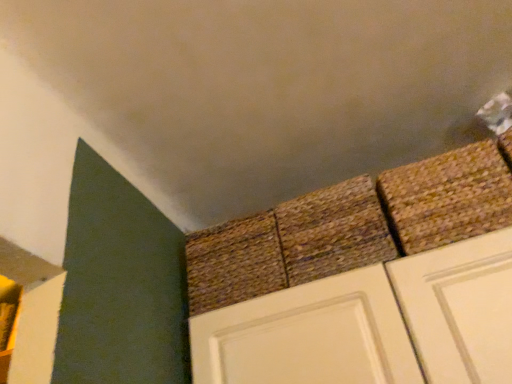
Question: From the image's perspective, is rustic woven mat at center, placed as the second brick when sorted from right to left, above brown woven rug at upper right, placed as the third brick when sorted from left to right?

Choices:
 (A) yes
 (B) no

Answer: (B)

Question: Would you say brown woven rug at upper right, the first brick positioned from the right, is part of rustic woven mat at center, placed as the second brick when sorted from right to left,'s contents?

Choices:
 (A) no
 (B) yes

Answer: (A)

Question: Is rustic woven mat at center, placed as the second brick when sorted from right to left, outside of brown woven rug at upper right, placed as the third brick when sorted from left to right?

Choices:
 (A) yes
 (B) no

Answer: (A)

Question: Is rustic woven mat at center, placed as the second brick when sorted from right to left, positioned behind brown woven rug at upper right, the first brick positioned from the right?

Choices:
 (A) yes
 (B) no

Answer: (A)

Question: Would you say brown woven mat at center, which ranks as the 1th brick in left-to-right order, is inside or outside rustic woven mat at center, the 2th brick in the left-to-right sequence?

Choices:
 (A) outside
 (B) inside

Answer: (A)

Question: Looking at their shapes, would you say brown woven mat at center, marked as the third brick in a right-to-left arrangement, is wider or thinner than rustic woven mat at center, placed as the second brick when sorted from right to left?

Choices:
 (A) thin
 (B) wide

Answer: (A)

Question: Relative to rustic woven mat at center, placed as the second brick when sorted from right to left, is brown woven mat at center, marked as the third brick in a right-to-left arrangement, in front or behind?

Choices:
 (A) behind
 (B) front

Answer: (A)

Question: From a real-world perspective, relative to rustic woven mat at center, placed as the second brick when sorted from right to left, is brown woven mat at center, which ranks as the 1th brick in left-to-right order, vertically above or below?

Choices:
 (A) below
 (B) above

Answer: (A)

Question: Visually, is rustic woven mat at center, placed as the second brick when sorted from right to left, positioned to the left or to the right of brown woven rug at upper right, placed as the third brick when sorted from left to right?

Choices:
 (A) right
 (B) left

Answer: (B)

Question: From the image's perspective, relative to brown woven rug at upper right, the first brick positioned from the right, is rustic woven mat at center, placed as the second brick when sorted from right to left, above or below?

Choices:
 (A) below
 (B) above

Answer: (A)

Question: From a real-world perspective, relative to brown woven rug at upper right, placed as the third brick when sorted from left to right, is rustic woven mat at center, the 2th brick in the left-to-right sequence, vertically above or below?

Choices:
 (A) below
 (B) above

Answer: (B)

Question: In terms of size, does rustic woven mat at center, placed as the second brick when sorted from right to left, appear bigger or smaller than brown woven rug at upper right, placed as the third brick when sorted from left to right?

Choices:
 (A) small
 (B) big

Answer: (B)

Question: Considering the positions of point (397, 226) and point (214, 231), is point (397, 226) closer or farther from the camera than point (214, 231)?

Choices:
 (A) closer
 (B) farther

Answer: (A)

Question: Looking at the image, does brown woven rug at upper right, placed as the third brick when sorted from left to right, seem bigger or smaller compared to brown woven mat at center, marked as the third brick in a right-to-left arrangement?

Choices:
 (A) big
 (B) small

Answer: (B)